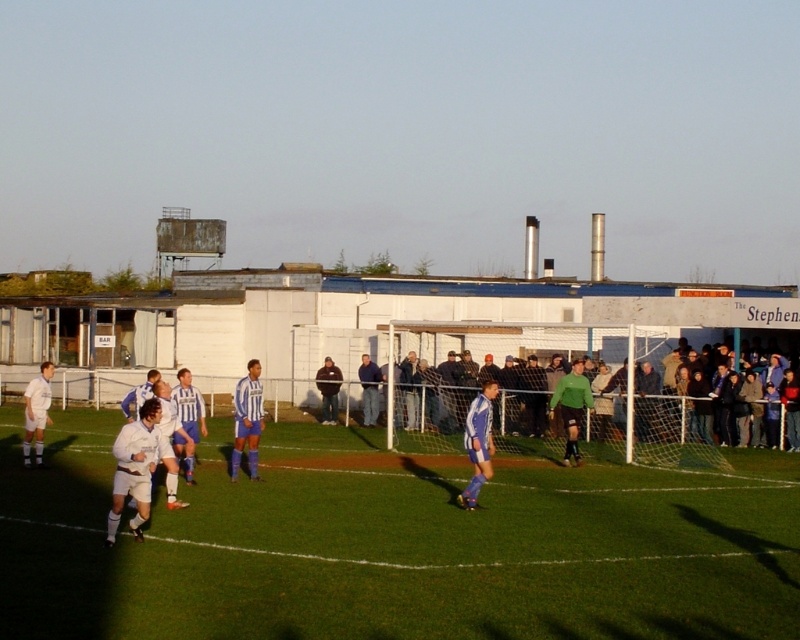
Between point (132, 429) and point (490, 380), which one is positioned behind?

Positioned behind is point (490, 380).

Who is shorter, white matte soccer player at center or blue/white striped jersey at center?

white matte soccer player at center

At what (x,y) coordinates should I click in order to perform the action: click on white matte soccer player at center. Please return your answer as a coordinate pair (x, y). This screenshot has height=640, width=800. Looking at the image, I should click on (136, 467).

The height and width of the screenshot is (640, 800). Identify the location of white matte soccer player at center. (136, 467).

Describe the element at coordinates (478, 442) in the screenshot. I see `blue/white striped jersey at center` at that location.

Between point (478, 490) and point (328, 400), which one is positioned in front?

Point (478, 490) is in front.

Where is `blue/white striped jersey at center`? Image resolution: width=800 pixels, height=640 pixels. blue/white striped jersey at center is located at coordinates (478, 442).

Is striped jersey at center thinner than white matte soccer player at left?

Answer: Indeed, striped jersey at center has a lesser width compared to white matte soccer player at left.

Who is taller, striped jersey at center or white matte soccer player at left?

white matte soccer player at left

Is point (180, 445) behind point (28, 428)?

No, it is not.

The height and width of the screenshot is (640, 800). Find the location of `striped jersey at center`. striped jersey at center is located at coordinates (188, 420).